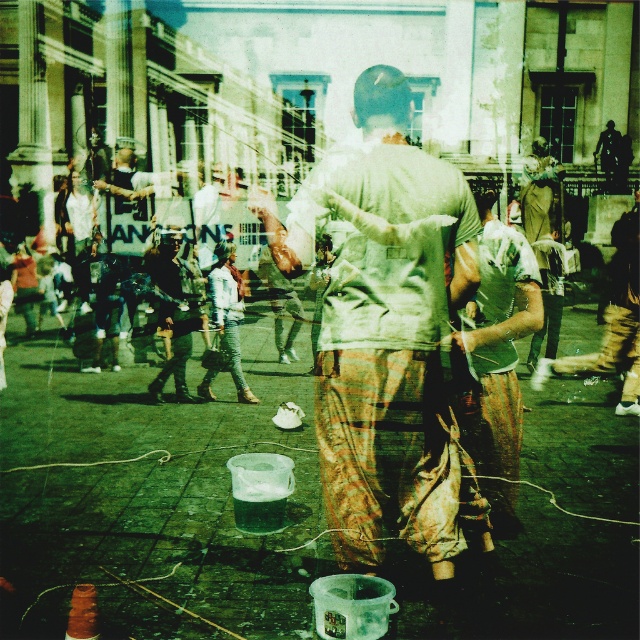
Based on the photo, is green fabric shirt at center above camouflage fabric shirt at center?

Actually, green fabric shirt at center is below camouflage fabric shirt at center.

Describe the element at coordinates (499, 336) in the screenshot. I see `green fabric shirt at center` at that location.

The width and height of the screenshot is (640, 640). I want to click on green fabric shirt at center, so click(499, 336).

Is point (324, 396) closer to camera compared to point (464, 342)?

No.

Measure the distance between point (371, 243) and camera.

A distance of 21.47 meters exists between point (371, 243) and camera.

Which is in front, point (266, 205) or point (518, 333)?

Point (518, 333)

Locate an element on the screen. light gray cotton shirt at center is located at coordinates (385, 326).

Is light gray cotton shirt at center bigger than camouflage fabric shirt at center?

Correct, light gray cotton shirt at center is larger in size than camouflage fabric shirt at center.

Find the location of a particular element. light gray cotton shirt at center is located at coordinates (385, 326).

Does point (397, 209) come farther from viewer compared to point (180, 305)?

No, (397, 209) is closer to viewer.

The height and width of the screenshot is (640, 640). I want to click on light gray cotton shirt at center, so click(385, 326).